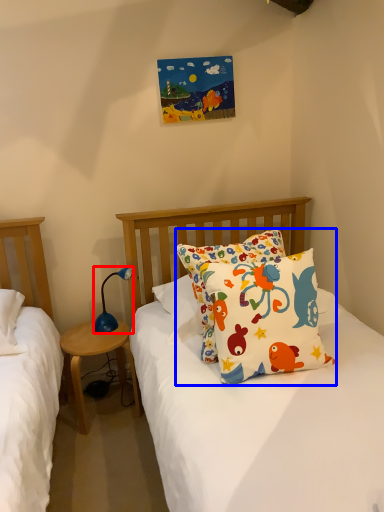
Question: Which object appears farthest to the camera in this image, lamp (highlighted by a red box) or pillow (highlighted by a blue box)?

Choices:
 (A) lamp
 (B) pillow

Answer: (A)